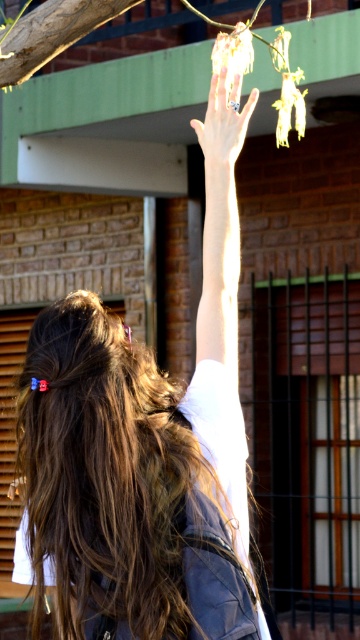
Can you confirm if light brown hair at upper center is taller than silver metallic ring at upper center?

Yes, light brown hair at upper center is taller than silver metallic ring at upper center.

Can you confirm if light brown hair at upper center is positioned to the left of silver metallic ring at upper center?

Indeed, light brown hair at upper center is positioned on the left side of silver metallic ring at upper center.

Locate an element on the screen. Image resolution: width=360 pixels, height=640 pixels. light brown hair at upper center is located at coordinates 138,467.

Which is above, light brown hair at upper center or matte black hand at upper center?

light brown hair at upper center

Is point (105, 452) farther from viewer compared to point (15, 481)?

No.

Locate an element on the screen. light brown hair at upper center is located at coordinates (138, 467).

The image size is (360, 640). Describe the element at coordinates (222, 125) in the screenshot. I see `silver metallic ring at upper center` at that location.

How much distance is there between silver metallic ring at upper center and matte black hand at upper center?

35.09 inches

The width and height of the screenshot is (360, 640). I want to click on silver metallic ring at upper center, so click(222, 125).

You are a GUI agent. You are given a task and a screenshot of the screen. Output one action in this format:
    pyautogui.click(x=<x>, y=<y>)
    Task: Click on the silver metallic ring at upper center
    
    Given the screenshot: What is the action you would take?
    pyautogui.click(x=222, y=125)